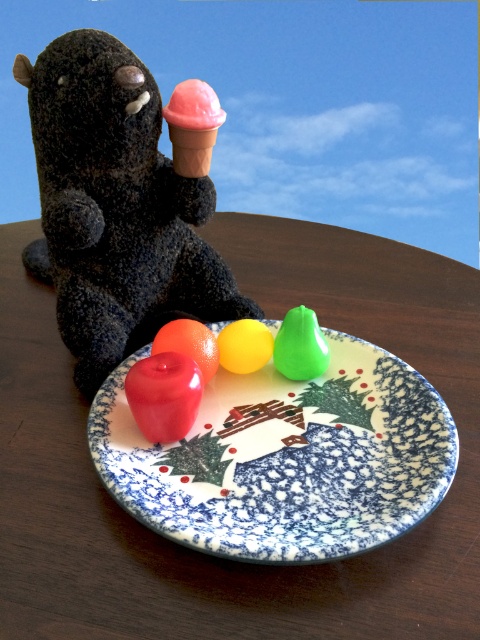
Question: Can you confirm if wooden table at center is positioned below pink matte ice cream cone at upper center?

Choices:
 (A) yes
 (B) no

Answer: (A)

Question: Is wooden table at center positioned behind pink matte ice cream cone at upper center?

Choices:
 (A) no
 (B) yes

Answer: (A)

Question: Among these points, which one is farthest from the camera?

Choices:
 (A) (212, 115)
 (B) (121, 312)

Answer: (B)

Question: Which of the following is the closest to the observer?

Choices:
 (A) (52, 93)
 (B) (197, 144)
 (C) (6, 451)

Answer: (C)

Question: In this image, where is speckled ceramic plate at center located relative to fuzzy black stuffed animal at left?

Choices:
 (A) left
 (B) right

Answer: (B)

Question: Which of the following is the farthest from the observer?

Choices:
 (A) pink matte ice cream cone at upper center
 (B) speckled ceramic plate at center
 (C) fuzzy black stuffed animal at left

Answer: (A)